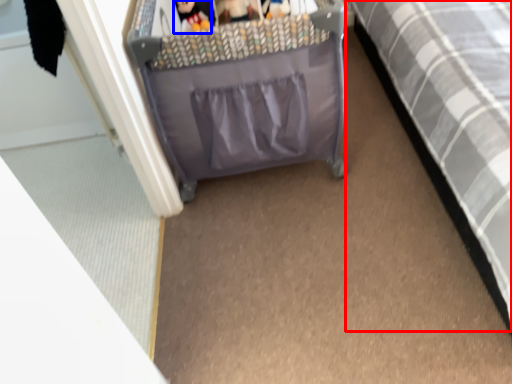
Question: Among these objects, which one is nearest to the camera, furniture (highlighted by a red box) or toy (highlighted by a blue box)?

Choices:
 (A) furniture
 (B) toy

Answer: (A)